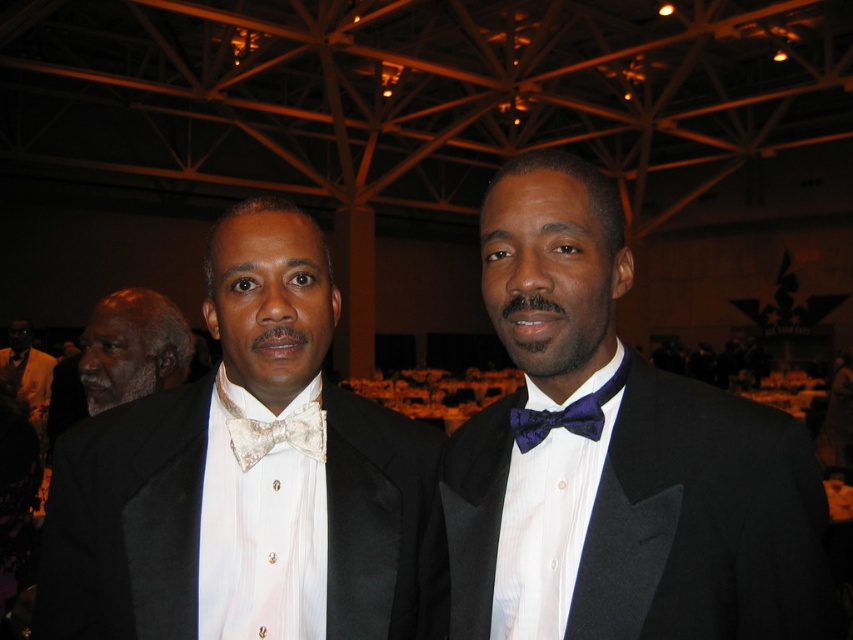
Is matte gold bow tie at center to the left of matte black suit at left from the viewer's perspective?

In fact, matte gold bow tie at center is to the right of matte black suit at left.

Does point (167, 442) come closer to viewer compared to point (21, 403)?

Yes, point (167, 442) is closer to viewer.

The width and height of the screenshot is (853, 640). Identify the location of matte gold bow tie at center. point(248,480).

Between matte black tuxedo at center and shiny black tuxedo at center, which one is positioned higher?

shiny black tuxedo at center

Is point (514, 346) positioned behind point (578, 305)?

Yes, point (514, 346) is farther from viewer.

Is point (262, 243) closer to viewer compared to point (605, 387)?

No, (262, 243) is behind (605, 387).

Locate an element on the screen. The image size is (853, 640). matte black tuxedo at center is located at coordinates (450, 461).

Does point (488, 588) lie in front of point (247, 451)?

Yes, it is.

How distant is shiny black tuxedo at center from pearl white satin bow tie at center?

shiny black tuxedo at center and pearl white satin bow tie at center are 15.49 inches apart.

Does point (592, 378) come behind point (222, 371)?

No, (592, 378) is in front of (222, 371).

This screenshot has width=853, height=640. In order to click on shiny black tuxedo at center in this screenshot , I will do `click(616, 458)`.